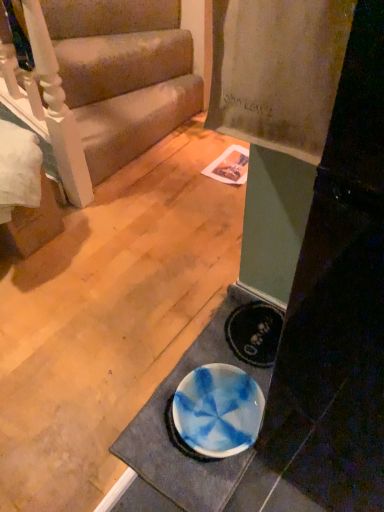
Measure the distance between white glossy doormat at lower center and camera.

The distance of white glossy doormat at lower center from camera is 1.06 meters.

Locate an element on the screen. white glossy doormat at lower center is located at coordinates (167, 433).

What do you see at coordinates (167, 433) in the screenshot?
I see `white glossy doormat at lower center` at bounding box center [167, 433].

What do you see at coordinates (101, 82) in the screenshot? The width and height of the screenshot is (384, 512). I see `beige fabric couch at upper left` at bounding box center [101, 82].

Locate an element on the screen. This screenshot has width=384, height=512. beige fabric couch at upper left is located at coordinates (101, 82).

The width and height of the screenshot is (384, 512). Identify the location of white glossy doormat at lower center. (167, 433).

Is beige fabric couch at upper left to the right of white glossy doormat at lower center from the viewer's perspective?

No, beige fabric couch at upper left is not to the right of white glossy doormat at lower center.

From the picture: Between beige fabric couch at upper left and white glossy doormat at lower center, which one is positioned behind?

Positioned behind is beige fabric couch at upper left.

Is point (113, 48) farther from camera compared to point (218, 309)?

Yes, point (113, 48) is behind point (218, 309).

From the image's perspective, would you say beige fabric couch at upper left is positioned over white glossy doormat at lower center?

Correct, beige fabric couch at upper left appears higher than white glossy doormat at lower center in the image.

From a real-world perspective, which is physically above, beige fabric couch at upper left or white glossy doormat at lower center?

beige fabric couch at upper left, from a real-world perspective.

Which of these two, beige fabric couch at upper left or white glossy doormat at lower center, is wider?

beige fabric couch at upper left.

Is beige fabric couch at upper left shorter than white glossy doormat at lower center?

Incorrect, the height of beige fabric couch at upper left does not fall short of that of white glossy doormat at lower center.

Considering the relative sizes of beige fabric couch at upper left and white glossy doormat at lower center in the image provided, is beige fabric couch at upper left smaller than white glossy doormat at lower center?

No, beige fabric couch at upper left is not smaller than white glossy doormat at lower center.

Is beige fabric couch at upper left completely or partially outside of white glossy doormat at lower center?

Yes.

Is there a large distance between beige fabric couch at upper left and white glossy doormat at lower center?

Indeed, beige fabric couch at upper left is not near white glossy doormat at lower center.

Is beige fabric couch at upper left turned away from white glossy doormat at lower center?

That's not correct — beige fabric couch at upper left is not looking away from white glossy doormat at lower center.

How far apart are beige fabric couch at upper left and white glossy doormat at lower center?

They are 1.13 meters apart.

At what (x,y) coordinates should I click in order to perform the action: click on doormat below the beige fabric couch at upper left (from the image's perspective). Please return your answer as a coordinate pair (x, y). The height and width of the screenshot is (512, 384). Looking at the image, I should click on pos(167,433).

Considering the relative positions of white glossy doormat at lower center and beige fabric couch at upper left in the image provided, is white glossy doormat at lower center to the left or to the right of beige fabric couch at upper left?

white glossy doormat at lower center is positioned on beige fabric couch at upper left's right side.

Which object is further away from the camera, white glossy doormat at lower center or beige fabric couch at upper left?

beige fabric couch at upper left is further from the camera.

Which is less distant, (202, 490) or (181, 35)?

The point (202, 490) is closer.

Looking at this image, from the image's perspective, does white glossy doormat at lower center appear lower than beige fabric couch at upper left?

Yes, from the image's perspective, white glossy doormat at lower center is below beige fabric couch at upper left.

From a real-world perspective, is white glossy doormat at lower center positioned above or below beige fabric couch at upper left?

Clearly, from a real-world perspective, white glossy doormat at lower center is below beige fabric couch at upper left.

Which object is wider, white glossy doormat at lower center or beige fabric couch at upper left?

beige fabric couch at upper left.

Is white glossy doormat at lower center taller or shorter than beige fabric couch at upper left?

Considering their sizes, white glossy doormat at lower center has less height than beige fabric couch at upper left.

Based on their sizes in the image, would you say white glossy doormat at lower center is bigger or smaller than beige fabric couch at upper left?

Clearly, white glossy doormat at lower center is smaller in size than beige fabric couch at upper left.

Consider the image. Would you say white glossy doormat at lower center is outside beige fabric couch at upper left?

white glossy doormat at lower center lies outside beige fabric couch at upper left's area.

Looking at this image, is white glossy doormat at lower center placed right next to beige fabric couch at upper left?

There is a gap between white glossy doormat at lower center and beige fabric couch at upper left.

Is white glossy doormat at lower center turned away from beige fabric couch at upper left?

That's not correct — white glossy doormat at lower center is not looking away from beige fabric couch at upper left.

Looking at this image, how much distance is there between white glossy doormat at lower center and beige fabric couch at upper left?

white glossy doormat at lower center is 1.13 meters from beige fabric couch at upper left.

Locate an element on the screen. doormat below the beige fabric couch at upper left (from the image's perspective) is located at coordinates (167, 433).

I want to click on studio couch above the white glossy doormat at lower center (from the image's perspective), so click(x=101, y=82).

There is a white glossy doormat at lower center. Identify the location of studio couch above it (from a real-world perspective). (101, 82).